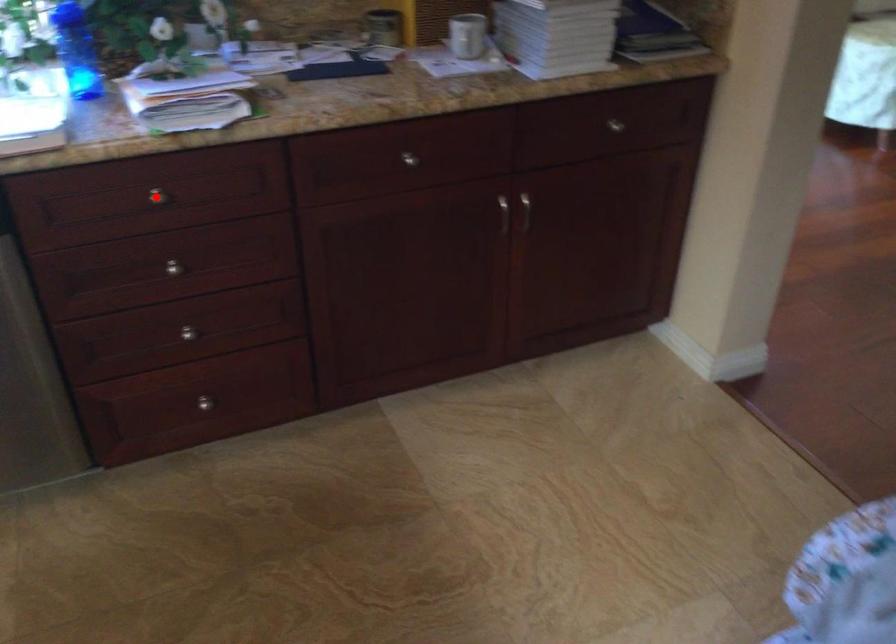
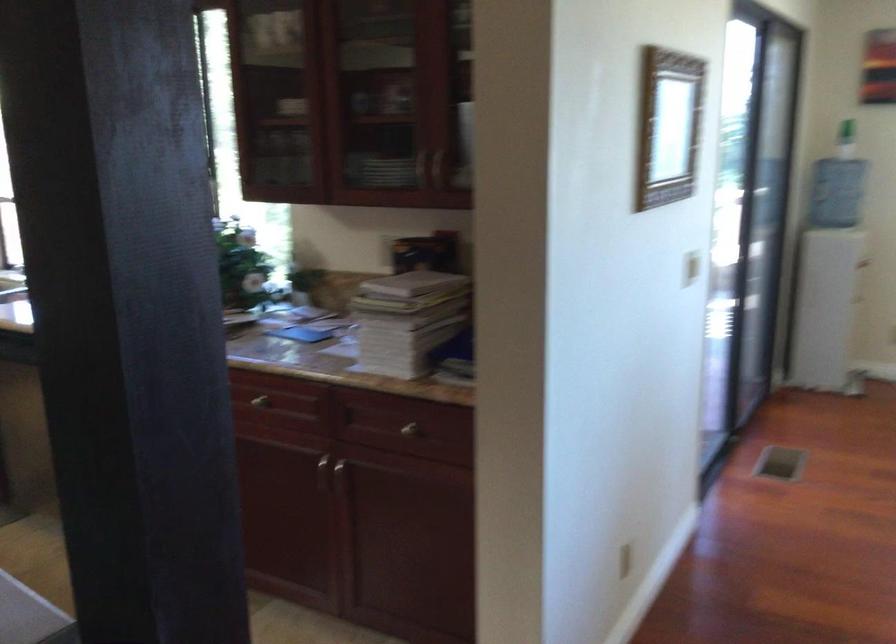
Question: I am providing you with two images of the same scene from different viewpoints. A red point is marked on the first image. At the location where the point appears in image 1, is it still visible in image 2?

Choices:
 (A) Yes
 (B) No

Answer: (B)